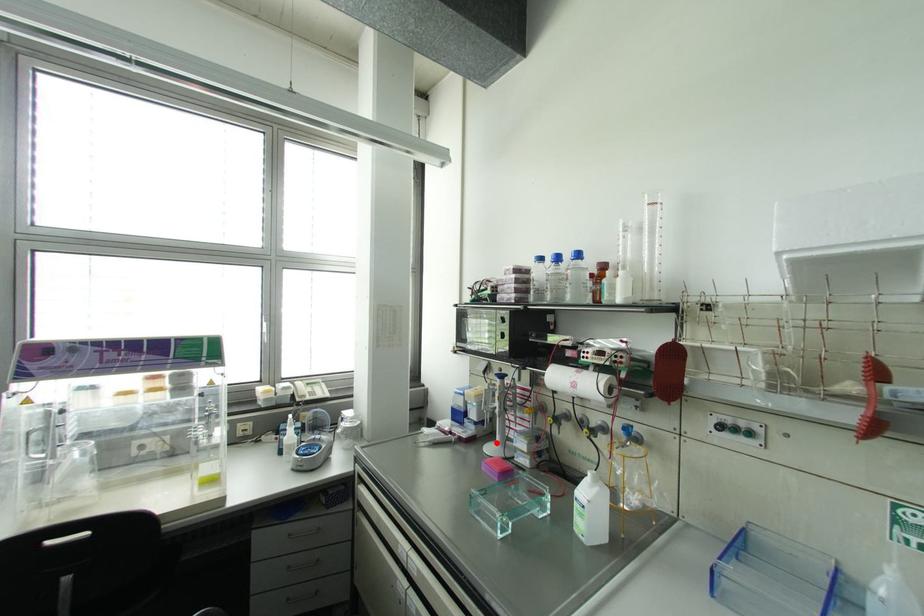
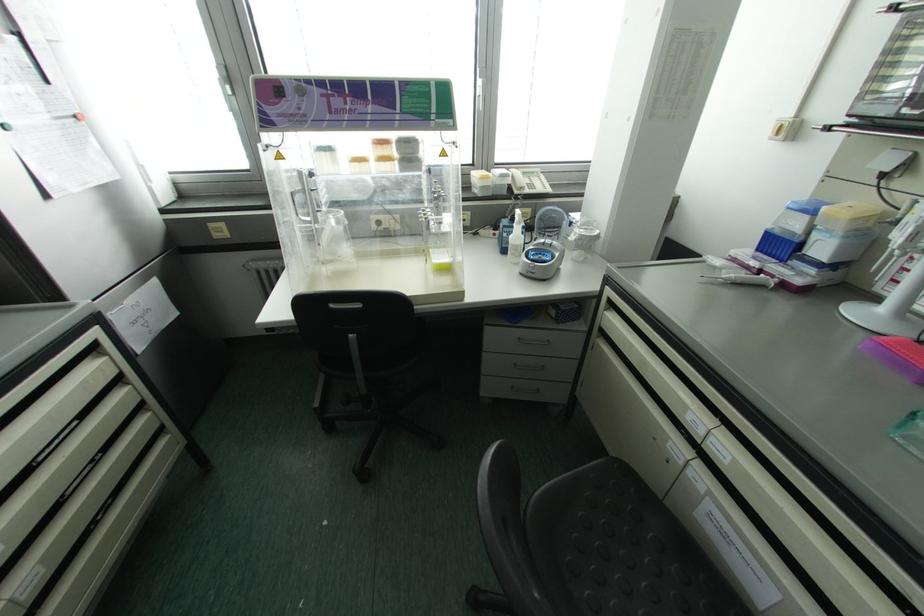
In the second image, find the point that corresponds to the highlighted location in the first image.

(881, 309)